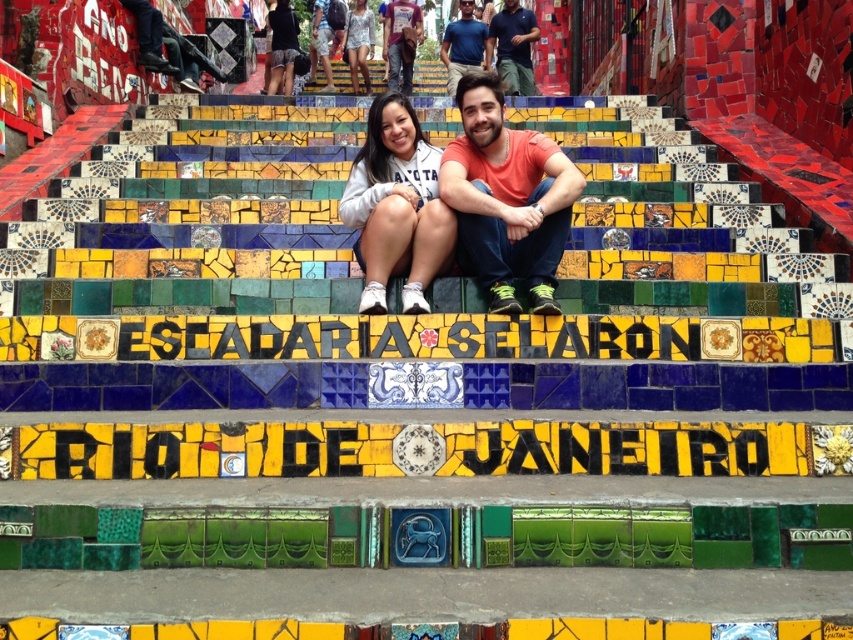
Question: Based on their relative distances, which object is farther from the blue cotton shirt at upper center?

Choices:
 (A) matte orange shirt at center
 (B) matte black dress at center

Answer: (B)

Question: Estimate the real-world distances between objects in this image. Which object is farther from the orange cotton shirt at center?

Choices:
 (A) white matte sweatshirt at center
 (B) matte orange shirt at center

Answer: (B)

Question: Does dark green cotton pants at center appear on the right side of blue cotton shirt at upper center?

Choices:
 (A) no
 (B) yes

Answer: (B)

Question: Is white matte sweatshirt at center closer to camera compared to matte black dress at center?

Choices:
 (A) no
 (B) yes

Answer: (B)

Question: Can you confirm if orange cotton shirt at center is wider than blue cotton shirt at upper center?

Choices:
 (A) no
 (B) yes

Answer: (B)

Question: Which of the following is the closest to the observer?

Choices:
 (A) dark green cotton pants at center
 (B) blue cotton shirt at upper center
 (C) orange cotton shirt at center
 (D) matte black dress at center

Answer: (C)